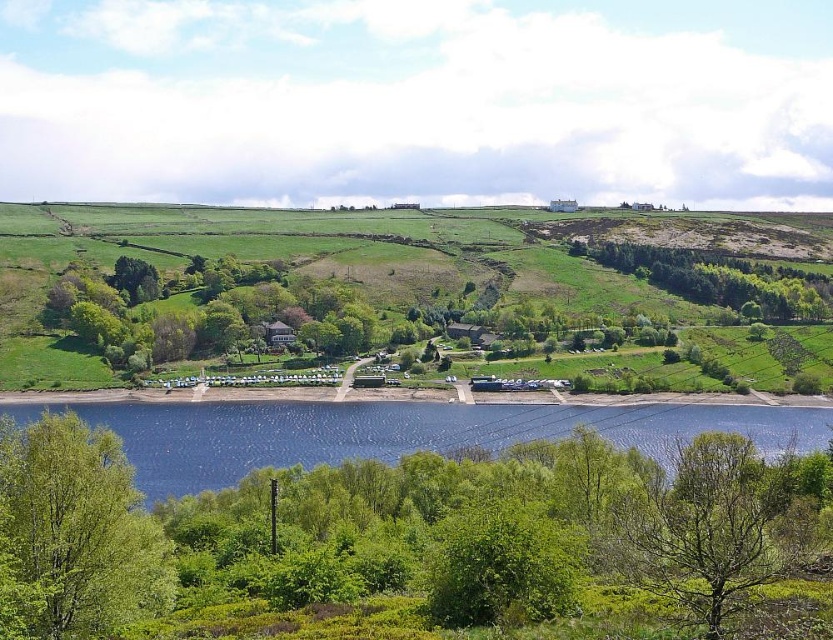
Question: Which of the following is the farthest from the observer?

Choices:
 (A) green leafy tree at lower left
 (B) green leafy tree at lower right

Answer: (A)

Question: Among these points, which one is farthest from the camera?

Choices:
 (A) (759, 289)
 (B) (118, 620)

Answer: (A)

Question: Is blue water at lower center smaller than green leafy tree at lower left?

Choices:
 (A) no
 (B) yes

Answer: (A)

Question: Which object is closer to the camera taking this photo?

Choices:
 (A) green leafy tree at center
 (B) green leafy tree at lower right

Answer: (B)

Question: Is green leafy tree at lower right bigger than green leafy trees at right?

Choices:
 (A) yes
 (B) no

Answer: (B)

Question: Is green leafy tree at lower left thinner than green leafy tree at center?

Choices:
 (A) no
 (B) yes

Answer: (B)